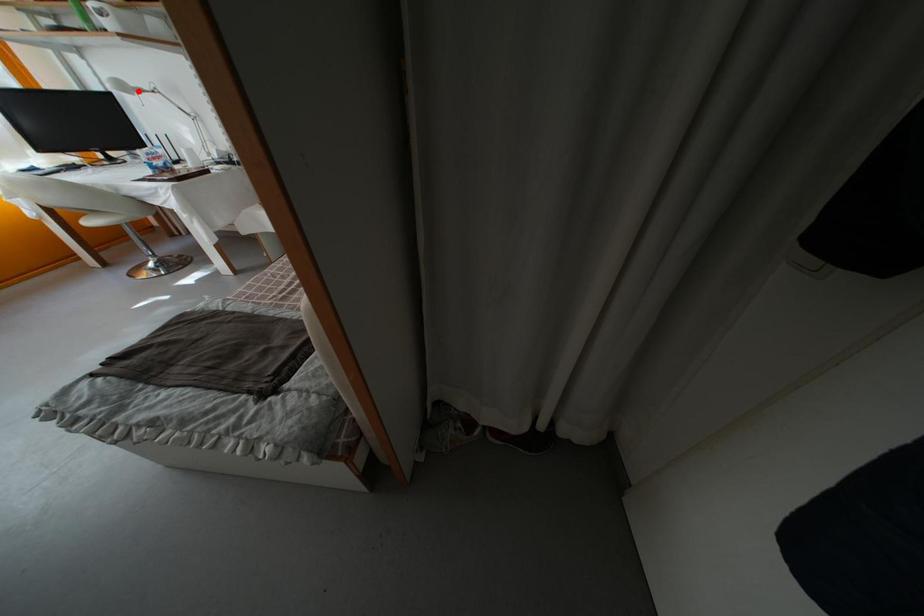
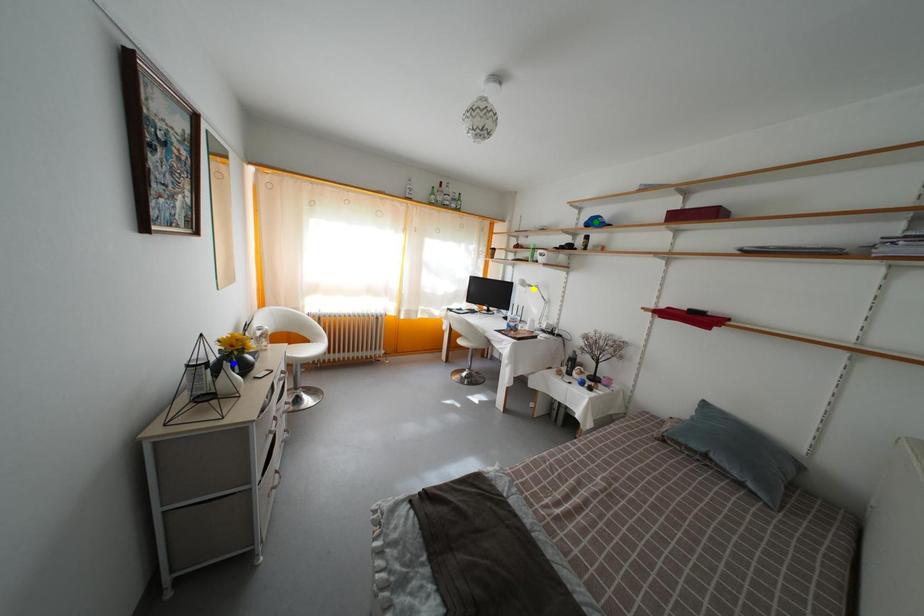
Question: I am providing you with two images of the same scene from different viewpoints. A red point is marked on the first image. You are given multiple points on the second image. In image 2, which mark is for the same physical point as the one in image 1?

Choices:
 (A) green point
 (B) blue point
 (C) yellow point

Answer: (C)